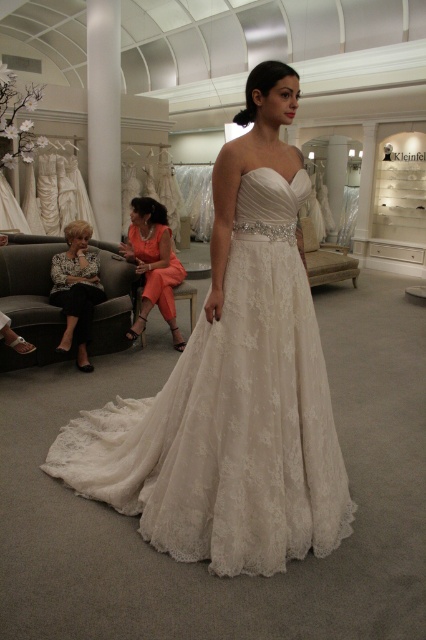
Can you confirm if ivory lace dress at center is wider than black leather jacket at lower left?

Yes.

Does point (216, 502) lie in front of point (57, 280)?

Yes, point (216, 502) is closer to viewer.

This screenshot has width=426, height=640. Identify the location of ivory lace dress at center. (233, 385).

Can you confirm if orange satin dress at center is shorter than black leather jacket at lower left?

In fact, orange satin dress at center may be taller than black leather jacket at lower left.

Does orange satin dress at center appear on the left side of black leather jacket at lower left?

In fact, orange satin dress at center is to the right of black leather jacket at lower left.

Describe the element at coordinates (154, 262) in the screenshot. I see `orange satin dress at center` at that location.

Find the location of a particular element. orange satin dress at center is located at coordinates (154, 262).

Who is higher up, ivory lace dress at center or orange satin dress at center?

orange satin dress at center is above.

Can you confirm if ivory lace dress at center is taller than orange satin dress at center?

Correct, ivory lace dress at center is much taller as orange satin dress at center.

Is point (293, 408) less distant than point (166, 209)?

Yes.

Identify the location of ivory lace dress at center. (233, 385).